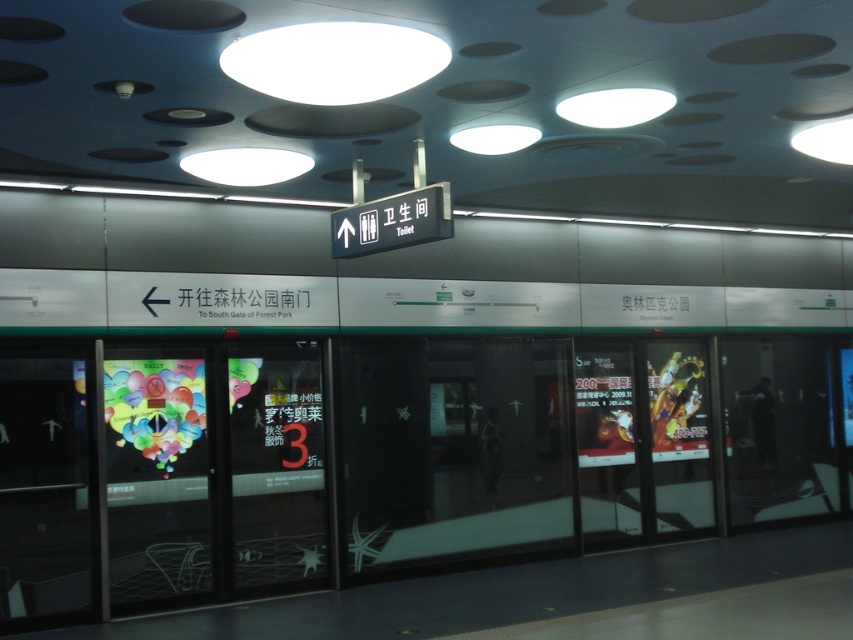
Who is more forward, (453, 419) or (669, 429)?

Positioned in front is point (453, 419).

Does point (553, 422) come closer to viewer compared to point (654, 502)?

Yes, it is.

What are the coordinates of `transparent glass door at center` in the screenshot? It's located at (451, 448).